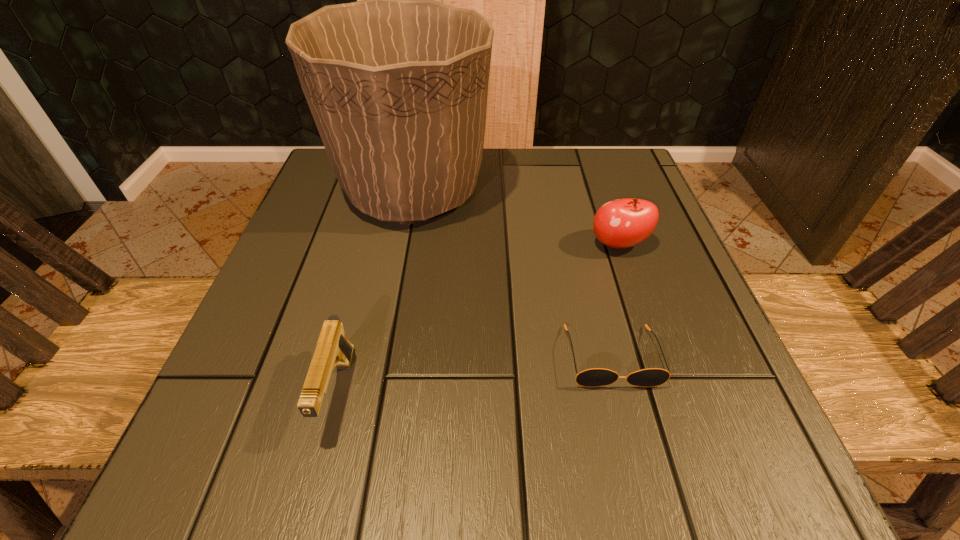
Identify which object is the third nearest to the shortest object. Please provide its 2D coordinates. Your answer should be formatted as a tuple, i.e. [(x, y)], where the tuple contains the x and y coordinates of a point satisfying the conditions above.

[(333, 349)]

Where is `the closest object relative to the pistol`? This screenshot has height=540, width=960. the closest object relative to the pistol is located at coordinates (397, 84).